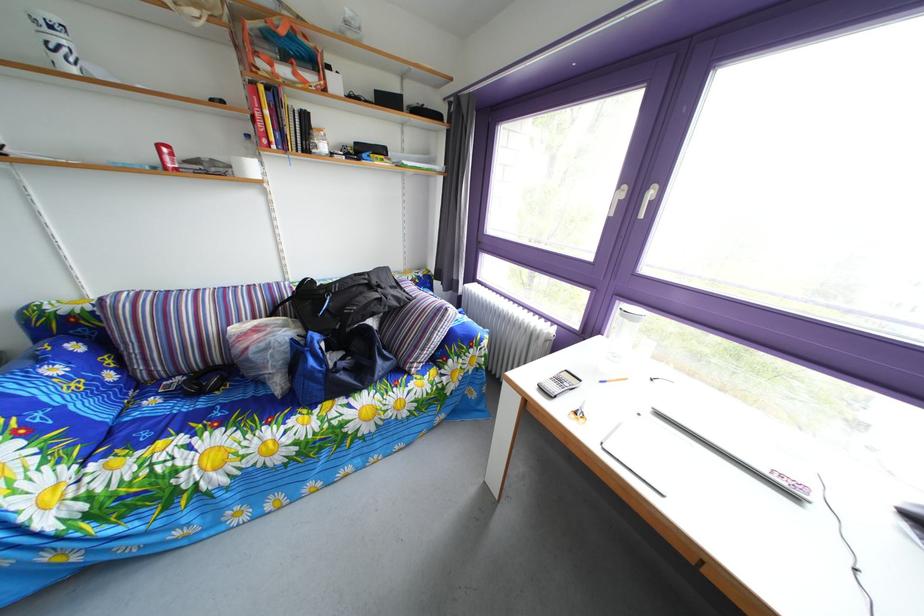
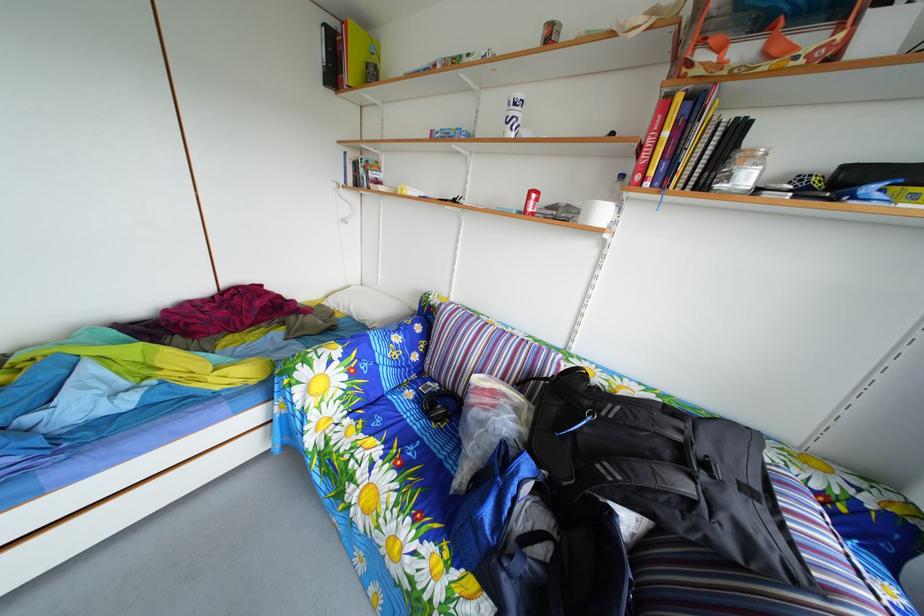
Question: How did the camera likely rotate?

Choices:
 (A) Left
 (B) Right
 (C) Up
 (D) Down

Answer: (A)